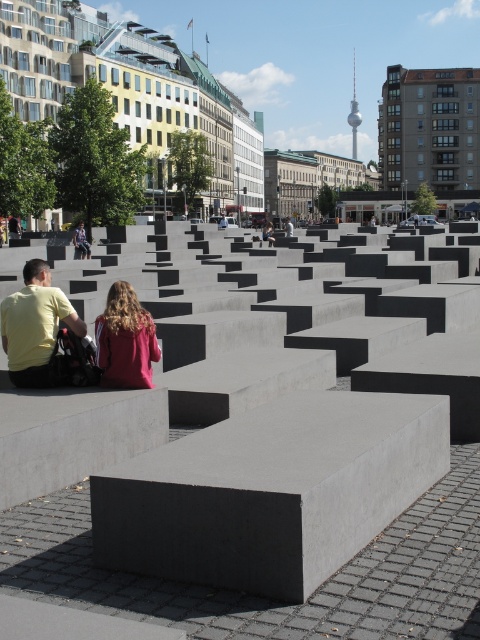
From the picture: You are an urban planner evaluating the space between the smooth gray concrete at center and the maroon fabric hair at center. Based on their sizes, which one would require more space for maintenance access?

The smooth gray concrete at center has a larger size compared to maroon fabric hair at center, so it would require more space for maintenance access.

You are standing in the urban landscape and want to touch both the smooth gray concrete at center and the maroon fabric hair at center. Which object should you reach for first to touch the one closer to you?

You should reach for the smooth gray concrete at center first because it is closer to you than the maroon fabric hair at center.

You are standing at the yellow matte shirt at lower left and want to reach the smooth gray concrete at center. Given that the average walking distance for an adult is about 10 feet, will you need to take more than 2 steps to reach it?

The distance between the smooth gray concrete at center and yellow matte shirt at lower left is 12.39 feet, which is longer than the average 10 feet walking distance. Therefore, you would need to take more than 2 steps to reach it.